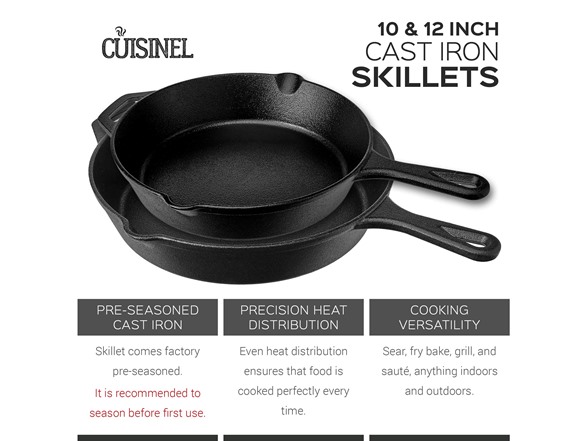
At what (x,y) coordinates should I click in order to perform the action: click on handle. Please return your answer as a coordinate pair (x, y). The width and height of the screenshot is (588, 441). Looking at the image, I should click on (464, 191), (467, 252).